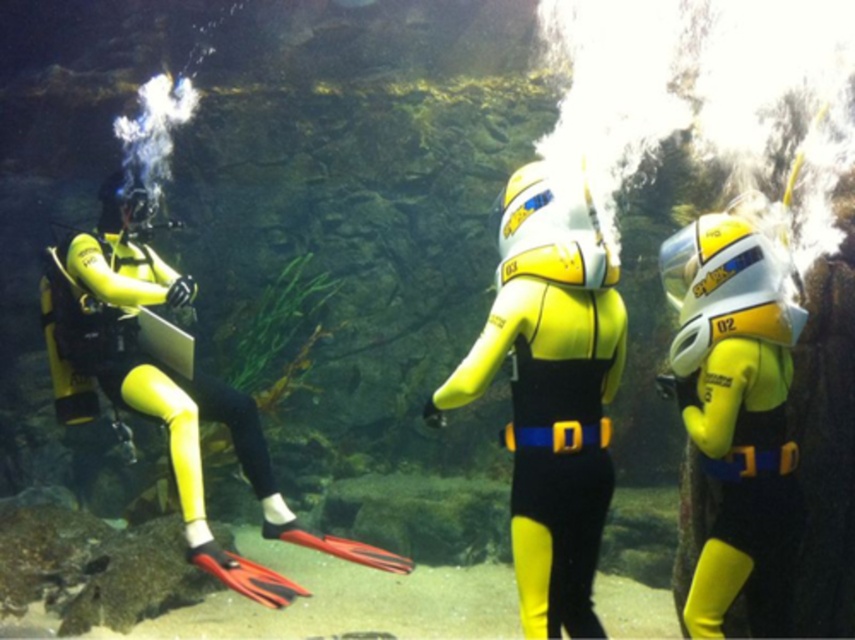
Question: Which object appears closest to the camera in this image?

Choices:
 (A) yellow matte wetsuit at left
 (B) yellow matte wetsuit at center
 (C) yellow matte scuba suit at right

Answer: (B)

Question: Which of the following is the closest to the observer?

Choices:
 (A) (761, 339)
 (B) (246, 410)
 (C) (588, 244)

Answer: (C)

Question: Can you confirm if yellow matte wetsuit at center is positioned to the left of yellow matte scuba suit at right?

Choices:
 (A) no
 (B) yes

Answer: (B)

Question: Which point is closer to the camera?

Choices:
 (A) (762, 472)
 (B) (48, 307)
 (C) (535, 620)

Answer: (C)

Question: Is yellow matte wetsuit at center thinner than yellow matte wetsuit at left?

Choices:
 (A) no
 (B) yes

Answer: (B)

Question: Is yellow matte wetsuit at center smaller than yellow matte wetsuit at left?

Choices:
 (A) yes
 (B) no

Answer: (A)